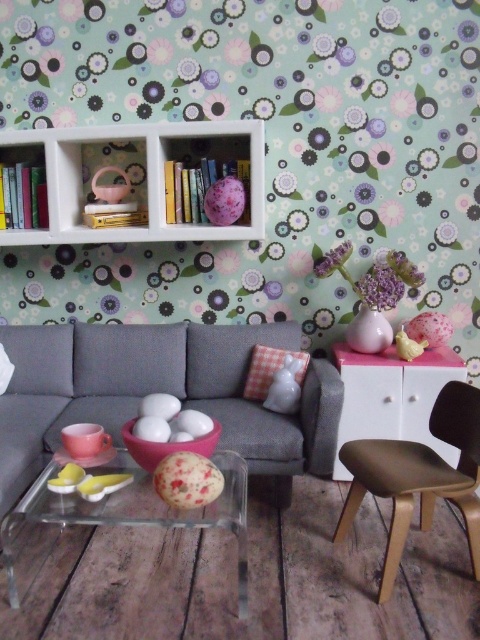
Question: Is transparent acrylic glass table at lower center bigger than pink glossy cabinet at right?

Choices:
 (A) yes
 (B) no

Answer: (A)

Question: Is pink glossy cabinet at right to the left of matte pink plastic basket at upper left from the viewer's perspective?

Choices:
 (A) yes
 (B) no

Answer: (B)

Question: Can you confirm if matte gray couch at center is thinner than white matte bookshelf at upper center?

Choices:
 (A) yes
 (B) no

Answer: (B)

Question: Which of the following is the closest to the observer?

Choices:
 (A) (8, 189)
 (B) (408, 476)

Answer: (B)

Question: Which of these objects is positioned closest to the matte gray couch at center?

Choices:
 (A) pink glossy cabinet at right
 (B) transparent acrylic glass table at lower center
 (C) white matte bookshelf at upper center

Answer: (B)

Question: Based on their relative distances, which object is nearer to the transparent acrylic glass table at lower center?

Choices:
 (A) purple matte flower at upper center
 (B) matte black books at left
 (C) matte gray couch at center
 (D) brown leather chair at lower right

Answer: (C)